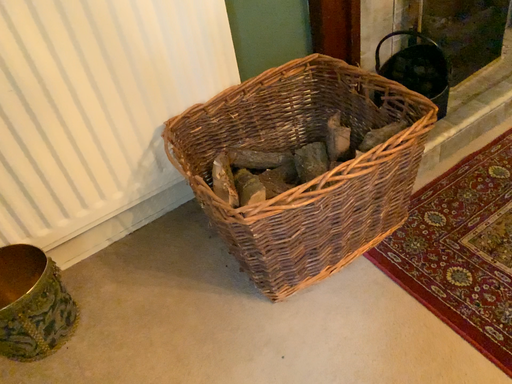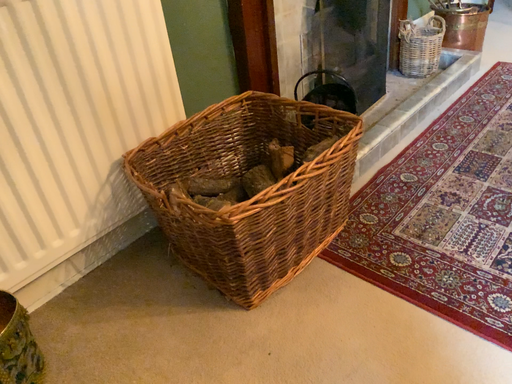
Question: Which way did the camera rotate in the video?

Choices:
 (A) rotated upward
 (B) rotated downward

Answer: (A)